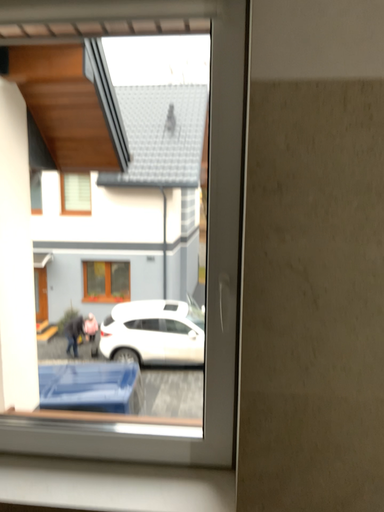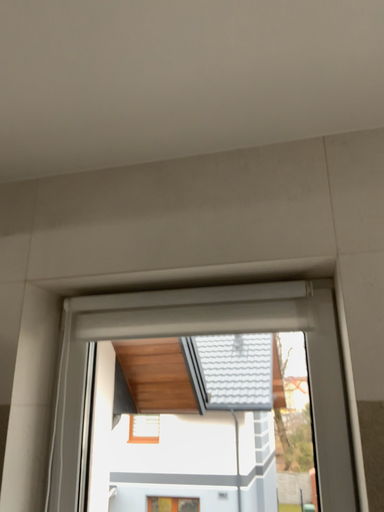
Question: Which way did the camera rotate in the video?

Choices:
 (A) rotated downward
 (B) rotated upward

Answer: (B)